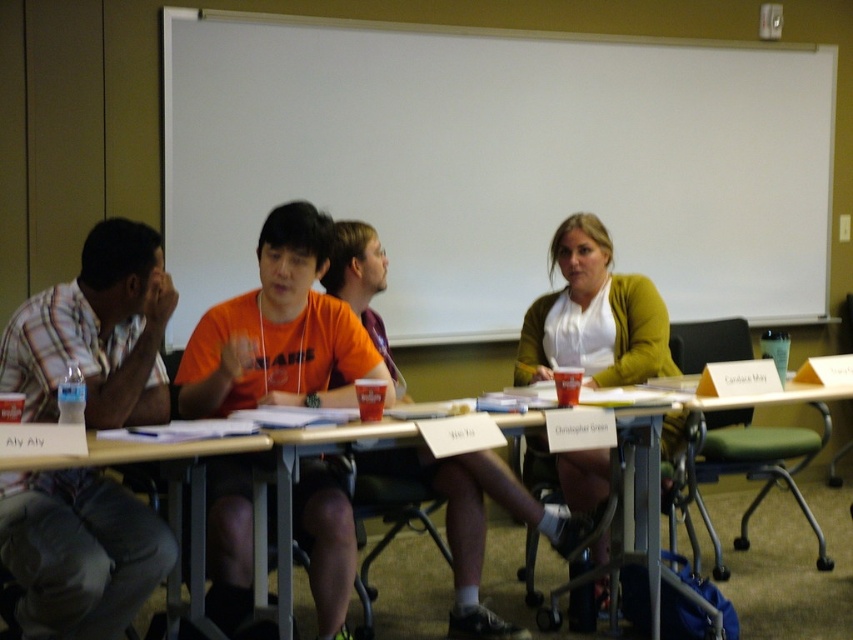
Question: Can you confirm if white matte board at upper center is smaller than metallic silver table at center?

Choices:
 (A) yes
 (B) no

Answer: (B)

Question: Based on their relative distances, which object is farther from the metallic silver table at center?

Choices:
 (A) white matte board at upper center
 (B) green fabric table at lower right

Answer: (A)

Question: Which point is farther to the camera?

Choices:
 (A) (85, 496)
 (B) (321, 264)
 (C) (177, 502)

Answer: (B)

Question: Can you confirm if white matte board at upper center is positioned above orange cotton shirt at center?

Choices:
 (A) yes
 (B) no

Answer: (A)

Question: Considering the real-world distances, which object is farthest from the matte green cardigan at center?

Choices:
 (A) orange cotton shirt at center
 (B) white matte board at upper center
 (C) metallic silver table at center

Answer: (B)

Question: Does white matte board at upper center lie in front of green fabric table at lower right?

Choices:
 (A) no
 (B) yes

Answer: (A)